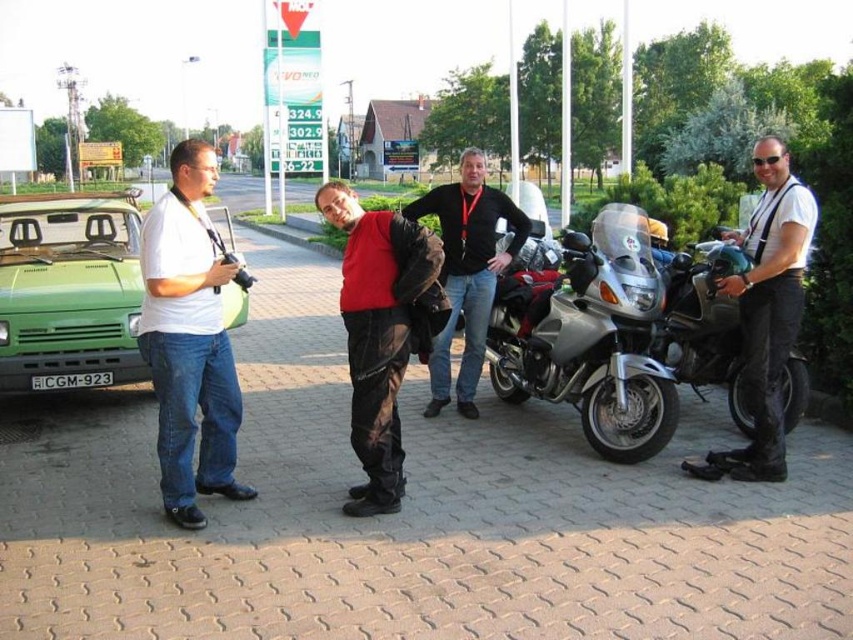
Question: Estimate the real-world distances between objects in this image. Which object is farther from the white matte shirt at left?

Choices:
 (A) silver metallic motorcycle at center
 (B) white matte shirt at right
 (C) red matte jacket at center

Answer: (B)

Question: Does white matte shirt at left come behind white matte shirt at right?

Choices:
 (A) no
 (B) yes

Answer: (A)

Question: Observing the image, what is the correct spatial positioning of white matte shirt at left in reference to red matte jacket at center?

Choices:
 (A) below
 (B) above

Answer: (A)

Question: Where is green matte van at left located in relation to dark gray leather jacket at center in the image?

Choices:
 (A) below
 (B) above

Answer: (B)

Question: Which object is the farthest from the white matte shirt at right?

Choices:
 (A) red matte jacket at center
 (B) black plastic license plate at center
 (C) white matte shirt at left

Answer: (B)

Question: Which of the following is the closest to the observer?

Choices:
 (A) dark gray leather jacket at center
 (B) green matte van at left
 (C) white matte shirt at right

Answer: (A)